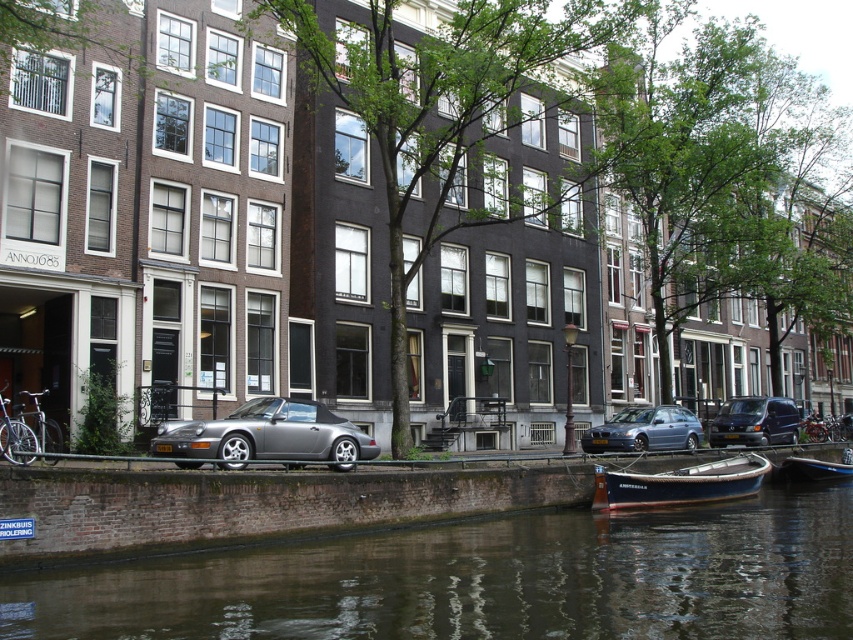
Does satin silver convertible at center come in front of metallic silver van at right?

Yes, satin silver convertible at center is closer to the viewer.

Locate an element on the screen. satin silver convertible at center is located at coordinates (267, 435).

The image size is (853, 640). What are the coordinates of `satin silver convertible at center` in the screenshot? It's located at (267, 435).

Locate an element on the screen. This screenshot has width=853, height=640. satin silver convertible at center is located at coordinates (267, 435).

Which of these two, dark brown water at lower center or satin silver convertible at center, stands taller?

With more height is dark brown water at lower center.

Between dark brown water at lower center and satin silver convertible at center, which one is positioned lower?

Positioned lower is dark brown water at lower center.

Locate an element on the screen. The height and width of the screenshot is (640, 853). dark brown water at lower center is located at coordinates (485, 579).

Does satin silver convertible at center have a greater width compared to wooden boat at lower center?

Incorrect, satin silver convertible at center's width does not surpass wooden boat at lower center's.

Between satin silver convertible at center and wooden boat at lower center, which one has less height?

satin silver convertible at center

Between point (331, 420) and point (733, 484), which one is positioned in front?

Point (331, 420) is more forward.

Where is `satin silver convertible at center`? This screenshot has width=853, height=640. satin silver convertible at center is located at coordinates (267, 435).